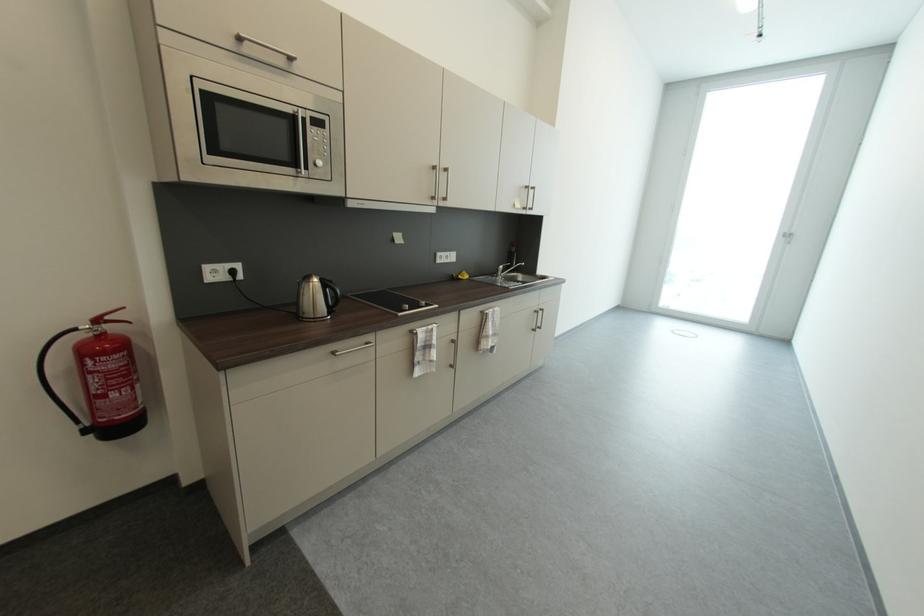
Where would you push the faucet lever? Please return your answer as a coordinate pair (x, y).

(508, 275)